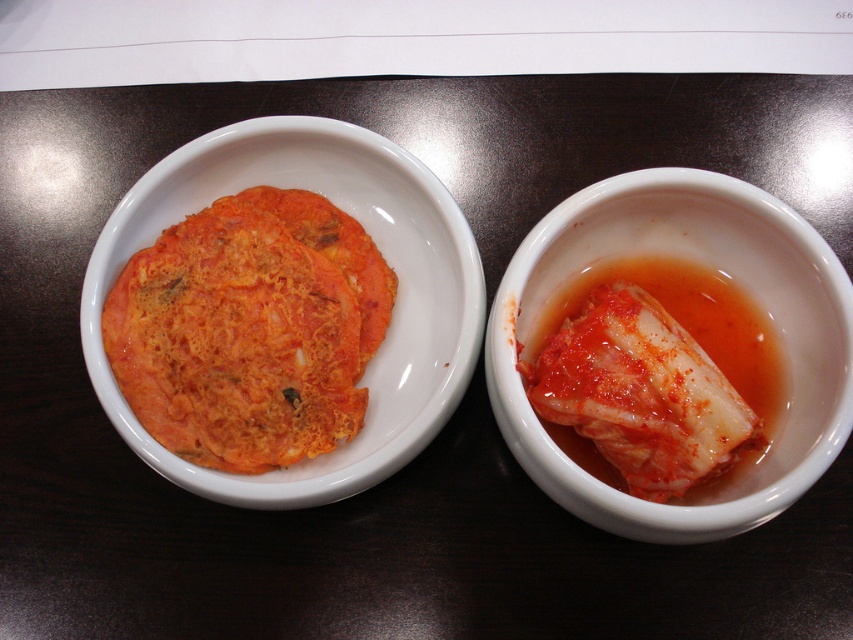
You are a food stylist arranging dishes on a table. You have an orange matte kimchi at left and a matte white bowl at center. Which object has a smaller width?

The orange matte kimchi at left has a smaller width than the matte white bowl at center.

You are a food photographer setting up a shoot. You have a matte white bowl at center and a white glossy kimchi at right. Which object is placed higher in the scene?

The matte white bowl at center is positioned over white glossy kimchi at right, so it is higher in the scene.